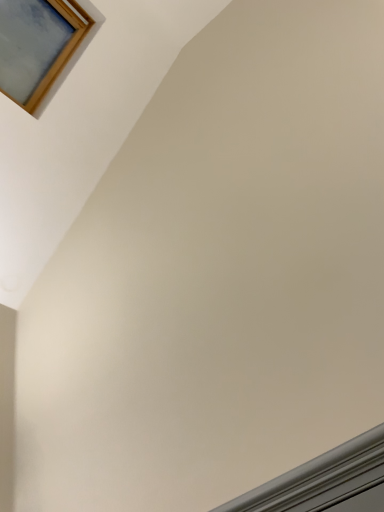
In order to face wooden picture frame at upper left, should I rotate leftwards or rightwards?

To align with it, rotate left about 20.945°.

At what (x,y) coordinates should I click in order to perform the action: click on wooden picture frame at upper left. Please return your answer as a coordinate pair (x, y). This screenshot has width=384, height=512. Looking at the image, I should click on (37, 45).

The height and width of the screenshot is (512, 384). What do you see at coordinates (37, 45) in the screenshot? I see `wooden picture frame at upper left` at bounding box center [37, 45].

The height and width of the screenshot is (512, 384). What are the coordinates of `wooden picture frame at upper left` in the screenshot? It's located at (37, 45).